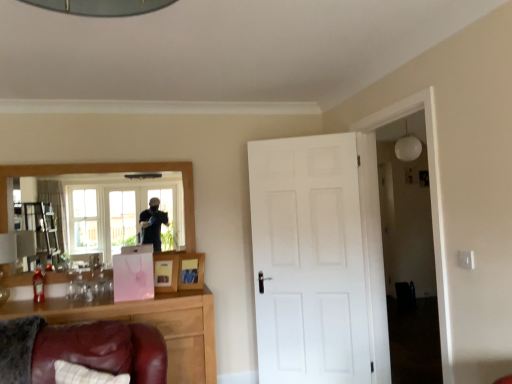
This screenshot has width=512, height=384. In order to click on wooden framed mirror at upper left in this screenshot , I will do `click(108, 210)`.

The height and width of the screenshot is (384, 512). What do you see at coordinates (148, 323) in the screenshot?
I see `brown wooden cabinet at lower left` at bounding box center [148, 323].

In order to face white matte door at center, should I rotate leftwards or rightwards?

Turn right by 7.024 degrees to look at white matte door at center.

In order to click on white matte light fixture at upper right in this screenshot , I will do `click(408, 147)`.

At what (x,y) coordinates should I click in order to perform the action: click on wooden framed mirror at upper left. Please return your answer as a coordinate pair (x, y). Image resolution: width=512 pixels, height=384 pixels. Looking at the image, I should click on (108, 210).

What's the angular difference between wooden photo frame at center, which is the second picture frame from left to right, and white matte door at center's facing directions?

The angular difference between wooden photo frame at center, which is the second picture frame from left to right, and white matte door at center is 1.24 degrees.

Looking at their sizes, would you say wooden photo frame at center, the first picture frame viewed from the right, is wider or thinner than white matte door at center?

Clearly, wooden photo frame at center, the first picture frame viewed from the right, has less width compared to white matte door at center.

Considering the sizes of objects wooden photo frame at center, the first picture frame viewed from the right, and white matte door at center in the image provided, who is shorter, wooden photo frame at center, the first picture frame viewed from the right, or white matte door at center?

wooden photo frame at center, the first picture frame viewed from the right.

Which is correct: wooden photo frame at center, which is the second picture frame from left to right, is inside white matte door at center, or outside of it?

wooden photo frame at center, which is the second picture frame from left to right, is not enclosed by white matte door at center.

Looking at this image, does brown wooden cabinet at lower left have a lesser height compared to pink paper picture frame at center, positioned as the second picture frame in right-to-left order?

In fact, brown wooden cabinet at lower left may be taller than pink paper picture frame at center, positioned as the second picture frame in right-to-left order.

From a real-world perspective, is brown wooden cabinet at lower left physically below pink paper picture frame at center, the 1th picture frame from the left?

Yes, from a real-world perspective, brown wooden cabinet at lower left is below pink paper picture frame at center, the 1th picture frame from the left.

Is pink paper picture frame at center, the 1th picture frame from the left, inside brown wooden cabinet at lower left?

No, pink paper picture frame at center, the 1th picture frame from the left, is not surrounded by brown wooden cabinet at lower left.

Which of these two, pink paper picture frame at center, the 1th picture frame from the left, or wooden framed mirror at upper left, is wider?

With larger width is pink paper picture frame at center, the 1th picture frame from the left.

Is pink paper picture frame at center, positioned as the second picture frame in right-to-left order, taller than wooden framed mirror at upper left?

Incorrect, the height of pink paper picture frame at center, positioned as the second picture frame in right-to-left order, is not larger of that of wooden framed mirror at upper left.

Is pink paper picture frame at center, positioned as the second picture frame in right-to-left order, not close to wooden framed mirror at upper left?

No, pink paper picture frame at center, positioned as the second picture frame in right-to-left order, is not far from wooden framed mirror at upper left.

Would you say wooden photo frame at center, the first picture frame viewed from the right, is inside or outside wooden framed mirror at upper left?

wooden photo frame at center, the first picture frame viewed from the right, is outside wooden framed mirror at upper left.

Is wooden photo frame at center, which is the second picture frame from left to right, to the left or to the right of wooden framed mirror at upper left in the image?

Based on their positions, wooden photo frame at center, which is the second picture frame from left to right, is located to the right of wooden framed mirror at upper left.

Based on their sizes in the image, would you say wooden photo frame at center, the first picture frame viewed from the right, is bigger or smaller than wooden framed mirror at upper left?

In the image, wooden photo frame at center, the first picture frame viewed from the right, appears to be smaller than wooden framed mirror at upper left.

Is wooden photo frame at center, the first picture frame viewed from the right, oriented away from wooden framed mirror at upper left?

No, wooden photo frame at center, the first picture frame viewed from the right,'s orientation is not away from wooden framed mirror at upper left.

Can you confirm if wooden photo frame at center, the first picture frame viewed from the right, is shorter than white matte light fixture at upper right?

Correct, wooden photo frame at center, the first picture frame viewed from the right, is not as tall as white matte light fixture at upper right.

Between wooden photo frame at center, the first picture frame viewed from the right, and white matte light fixture at upper right, which one has larger size?

white matte light fixture at upper right is bigger.

From a real-world perspective, is wooden photo frame at center, which is the second picture frame from left to right, on white matte light fixture at upper right?

No, from a real-world perspective, wooden photo frame at center, which is the second picture frame from left to right, is not on top of white matte light fixture at upper right.

Consider the image. Could you tell me if wooden photo frame at center, which is the second picture frame from left to right, is facing white matte light fixture at upper right?

No, wooden photo frame at center, which is the second picture frame from left to right, is not turned towards white matte light fixture at upper right.

Does white matte light fixture at upper right touch wooden photo frame at center, the first picture frame viewed from the right?

No.

From the image's perspective, is white matte light fixture at upper right beneath wooden photo frame at center, which is the second picture frame from left to right?

No, from the image's perspective, white matte light fixture at upper right is not beneath wooden photo frame at center, which is the second picture frame from left to right.

Does white matte light fixture at upper right appear on the left side of wooden photo frame at center, the first picture frame viewed from the right?

Incorrect, white matte light fixture at upper right is not on the left side of wooden photo frame at center, the first picture frame viewed from the right.

From a real-world perspective, is white matte light fixture at upper right on top of wooden photo frame at center, the first picture frame viewed from the right?

Yes, from a real-world perspective, white matte light fixture at upper right is over wooden photo frame at center, the first picture frame viewed from the right

Which object is thinner, white matte light fixture at upper right or wooden framed mirror at upper left?

wooden framed mirror at upper left.

From the image's perspective, is white matte light fixture at upper right located above or below wooden framed mirror at upper left?

From the image's perspective, white matte light fixture at upper right appears above wooden framed mirror at upper left.

In terms of height, does white matte light fixture at upper right look taller or shorter compared to wooden framed mirror at upper left?

Considering their sizes, white matte light fixture at upper right has less height than wooden framed mirror at upper left.

Is wooden framed mirror at upper left located within white matte light fixture at upper right?

That's incorrect, wooden framed mirror at upper left is not inside white matte light fixture at upper right.

Where is `door that appears on the right of wooden photo frame at center, which is the second picture frame from left to right`? This screenshot has width=512, height=384. door that appears on the right of wooden photo frame at center, which is the second picture frame from left to right is located at coordinates (318, 260).

Image resolution: width=512 pixels, height=384 pixels. I want to click on cabinetry in front of the pink paper picture frame at center, the 1th picture frame from the left, so click(x=148, y=323).

Based on their spatial positions, is wooden framed mirror at upper left or white matte light fixture at upper right closer to brown wooden cabinet at lower left?

wooden framed mirror at upper left lies closer to brown wooden cabinet at lower left than the other object.

Which object lies further to the anchor point brown wooden cabinet at lower left, pink paper picture frame at center, positioned as the second picture frame in right-to-left order, or wooden framed mirror at upper left?

The object further to brown wooden cabinet at lower left is wooden framed mirror at upper left.

From the image, which object appears to be nearer to wooden framed mirror at upper left, brown wooden cabinet at lower left or white matte light fixture at upper right?

brown wooden cabinet at lower left is closer to wooden framed mirror at upper left.

Looking at the image, which one is located closer to white matte door at center, white matte light fixture at upper right or wooden photo frame at center, which is the second picture frame from left to right?

Among the two, wooden photo frame at center, which is the second picture frame from left to right, is located nearer to white matte door at center.

Based on their spatial positions, is white matte light fixture at upper right or brown wooden cabinet at lower left further from wooden photo frame at center, which is the second picture frame from left to right?

white matte light fixture at upper right.

From the image, which object appears to be farther from wooden photo frame at center, the first picture frame viewed from the right, white matte light fixture at upper right or wooden framed mirror at upper left?

white matte light fixture at upper right lies further to wooden photo frame at center, the first picture frame viewed from the right, than the other object.

Based on their spatial positions, is white matte light fixture at upper right or pink paper picture frame at center, the 1th picture frame from the left, closer to wooden photo frame at center, which is the second picture frame from left to right?

pink paper picture frame at center, the 1th picture frame from the left.

Based on their spatial positions, is wooden framed mirror at upper left or brown wooden cabinet at lower left further from white matte door at center?

wooden framed mirror at upper left is positioned further to the anchor white matte door at center.

What are the coordinates of `cabinetry between wooden framed mirror at upper left and white matte light fixture at upper right in the horizontal direction` in the screenshot? It's located at (148, 323).

The height and width of the screenshot is (384, 512). I want to click on cabinetry between wooden framed mirror at upper left and white matte door at center from left to right, so click(148, 323).

Where is `door located between brown wooden cabinet at lower left and white matte light fixture at upper right in the left-right direction`? Image resolution: width=512 pixels, height=384 pixels. door located between brown wooden cabinet at lower left and white matte light fixture at upper right in the left-right direction is located at coordinates pos(318,260).

The height and width of the screenshot is (384, 512). I want to click on picture frame located between pink paper picture frame at center, positioned as the second picture frame in right-to-left order, and white matte door at center in the left-right direction, so click(x=191, y=271).